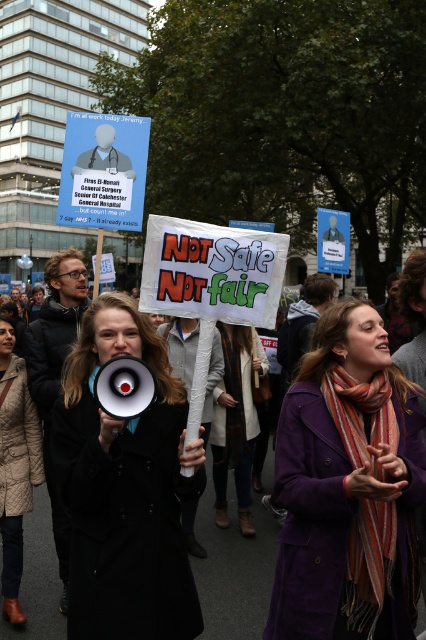
You are a photographer trying to capture the protest scene. You want to focus on the purple woolen coat at center. What are the coordinates where you should aim your camera?

The purple woolen coat at center is located at coordinates point (345, 484).

You are a photographer trying to capture a clear photo of the purple woolen coat at center and the knitted wool scarf at center. Since you want to focus on the coat, will the scarf be visible in the photo?

The purple woolen coat at center is in front of the knitted wool scarf at center, so the scarf will be partially or fully obscured by the coat in the photo.

You are part of a protest and need to identify the person holding the megaphone. Which coat is the megaphone holder wearing, the black matte coat at center or the black fabric coat at center?

The black matte coat at center has a larger size compared to black fabric coat at center. Since the megaphone holder is likely to be a prominent figure, they are more likely wearing the larger black matte coat at center.